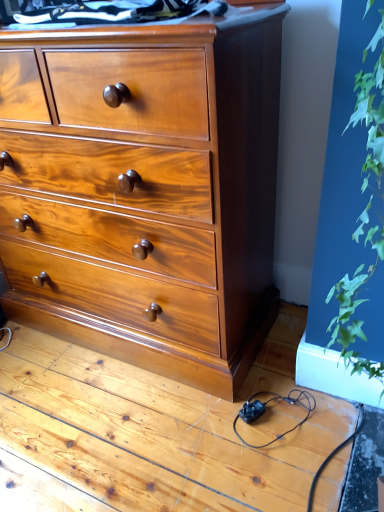
Where is `black plastic cable at lower center`? The image size is (384, 512). black plastic cable at lower center is located at coordinates (265, 409).

The image size is (384, 512). Describe the element at coordinates (265, 409) in the screenshot. I see `black plastic cable at lower center` at that location.

Measure the distance between black plastic cable at lower center and camera.

The depth of black plastic cable at lower center is 1.13 meters.

You are a GUI agent. You are given a task and a screenshot of the screen. Output one action in this format:
    pyautogui.click(x=<x>, y=<y>)
    Task: Click on the black plastic cable at lower center
    The height and width of the screenshot is (512, 384).
    Given the screenshot: What is the action you would take?
    pyautogui.click(x=265, y=409)